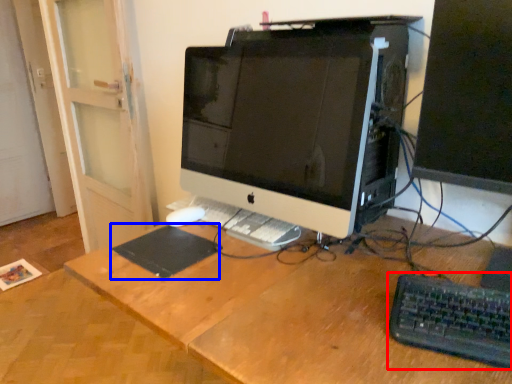
Question: Among these objects, which one is nearest to the camera, computer keyboard (highlighted by a red box) or mousepad (highlighted by a blue box)?

Choices:
 (A) computer keyboard
 (B) mousepad

Answer: (A)